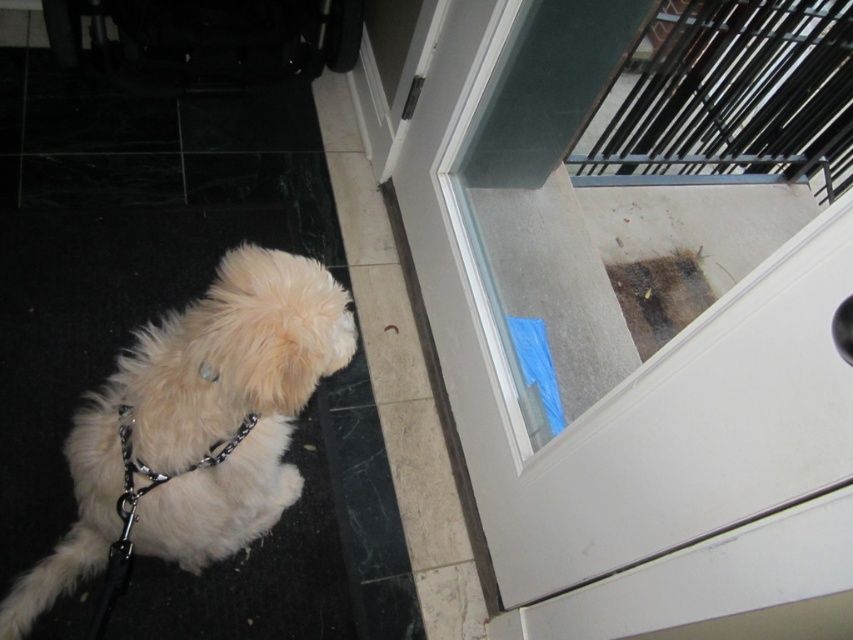
Question: Is transparent glass screen door at upper right below white fluffy dog at lower left?

Choices:
 (A) no
 (B) yes

Answer: (A)

Question: Can you confirm if transparent glass screen door at upper right is bigger than white fluffy dog at lower left?

Choices:
 (A) yes
 (B) no

Answer: (A)

Question: Among these points, which one is farthest from the camera?

Choices:
 (A) (86, 532)
 (B) (444, 269)

Answer: (B)

Question: Which of the following is the closest to the observer?

Choices:
 (A) (186, 483)
 (B) (814, 481)

Answer: (B)

Question: Can you confirm if transparent glass screen door at upper right is bigger than white fluffy dog at lower left?

Choices:
 (A) no
 (B) yes

Answer: (B)